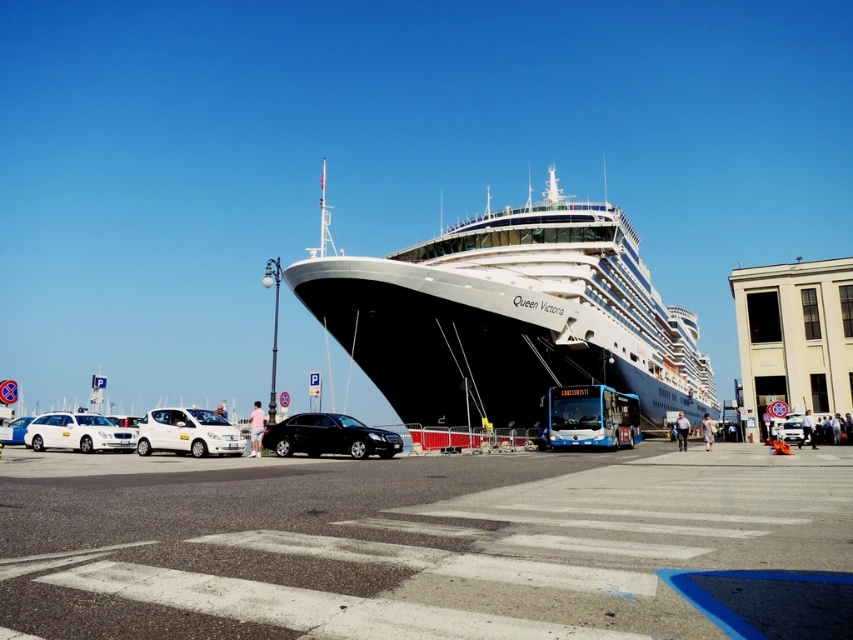
Question: Does black asphalt parking lot at center appear over white glossy sedan at center-left?

Choices:
 (A) no
 (B) yes

Answer: (B)

Question: Which of the following is the closest to the observer?

Choices:
 (A) black asphalt parking lot at center
 (B) white matte station wagon at left
 (C) white matte car at lower left
 (D) white glossy sedan at center-left

Answer: (A)

Question: Which of the following is the closest to the observer?

Choices:
 (A) white matte station wagon at left
 (B) white glossy sedan at center-left
 (C) shiny black sedan at center

Answer: (C)

Question: Which object is the closest to the white matte station wagon at left?

Choices:
 (A) white matte car at lower left
 (B) white glossy cruise ship at center
 (C) black asphalt parking lot at center
 (D) shiny black sedan at center

Answer: (A)

Question: Is shiny black sedan at center smaller than white matte car at lower left?

Choices:
 (A) yes
 (B) no

Answer: (B)

Question: Does black asphalt parking lot at center have a lesser width compared to white glossy sedan at center-left?

Choices:
 (A) yes
 (B) no

Answer: (B)